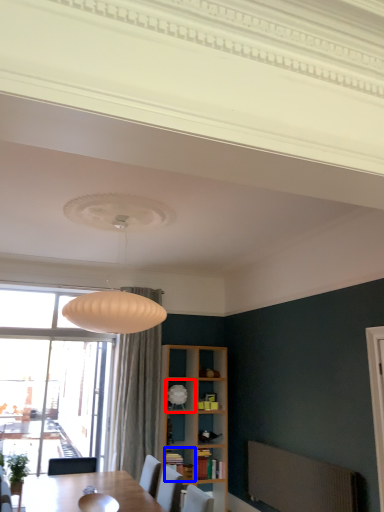
Question: Which object appears closest to the camera in this image, shelf (highlighted by a red box) or shelf (highlighted by a blue box)?

Choices:
 (A) shelf
 (B) shelf

Answer: (B)